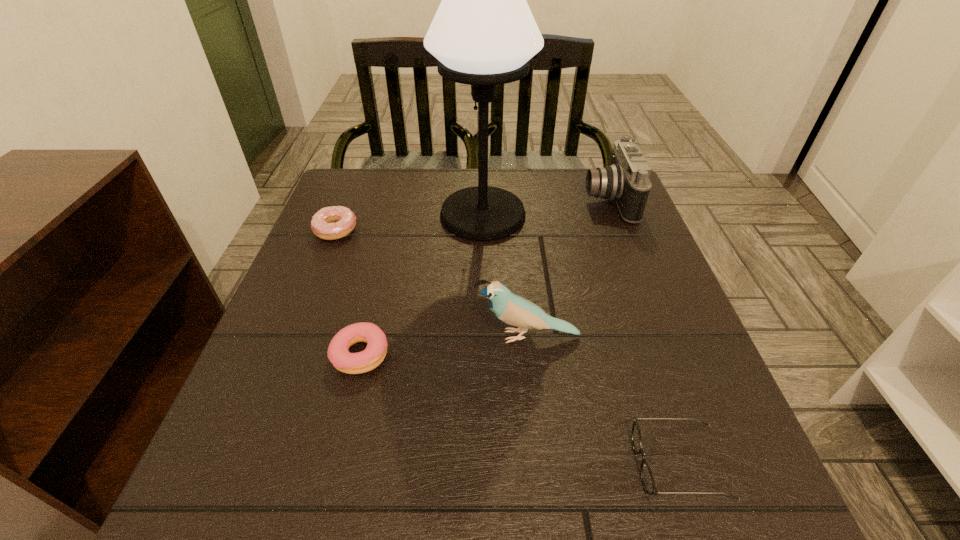
Where is `blank space located on the front-facing side of the camera`? blank space located on the front-facing side of the camera is located at coordinates (474, 200).

You are a GUI agent. You are given a task and a screenshot of the screen. Output one action in this format:
    pyautogui.click(x=<x>, y=<y>)
    Task: Click on the vacant region located on the front-facing side of the camera
    
    Given the screenshot: What is the action you would take?
    pyautogui.click(x=554, y=200)

Locate an element on the screen. This screenshot has height=540, width=960. vacant region located 0.080m at the face of the bird is located at coordinates pos(432,336).

This screenshot has width=960, height=540. I want to click on free space located 0.060m at the face of the bird, so click(x=443, y=336).

In order to click on vacant space located 0.190m at the face of the bird in this screenshot , I will do `click(373, 336)`.

Where is `free region located on the right of the farther doughnut`? Image resolution: width=960 pixels, height=540 pixels. free region located on the right of the farther doughnut is located at coordinates (452, 230).

This screenshot has height=540, width=960. I want to click on free region located on the back of the second object from left to right, so click(x=390, y=234).

Where is `vacant region located 0.180m through the lenses of the nearest object`? This screenshot has width=960, height=540. vacant region located 0.180m through the lenses of the nearest object is located at coordinates (514, 464).

The width and height of the screenshot is (960, 540). Identify the location of free space located 0.090m through the lenses of the nearest object. (575, 464).

Where is `free space located 0.180m through the lenses of the nearest object`? free space located 0.180m through the lenses of the nearest object is located at coordinates (514, 464).